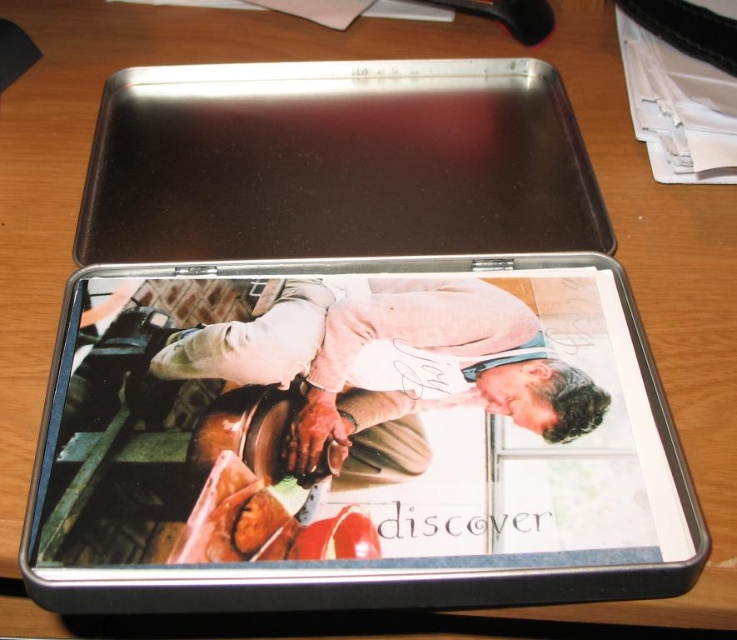
You are organizing a display in a museum and need to place the metallic silver tray at center and the matte beige sweater at center on a shelf. The shelf has limited height clearance. Based on the scene description, which object should be placed first to ensure it fits under the shelf without hitting the ceiling?

The matte beige sweater at center should be placed first because it is shorter than the metallic silver tray at center, allowing it to fit under the shelf clearance while the taller tray can be adjusted accordingly.

You are organizing a display in a museum and need to place the metallic silver tablet at center and the metallic silver tray at center on a shelf. According to the image, which object is closer to the viewer?

The metallic silver tablet at center is closer to the viewer because it is in front of the metallic silver tray at center.

You are holding a metallic silver tablet at center that you want to place on a shelf that is 20 inches away from you. Based on the scene description, will the tablet fit on the shelf if the shelf is exactly 20 inches away from you?

The metallic silver tablet at center is 19.27 inches away from the viewer, so placing it on a shelf that is 20 inches away would work since the distance is sufficient.